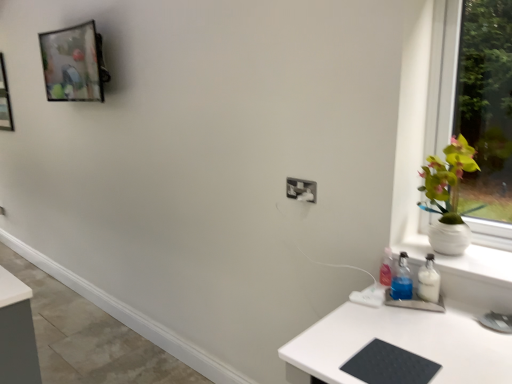
Where is `free area below metallic glass picture frame at upper left (from a real-world perspective)`? The image size is (512, 384). free area below metallic glass picture frame at upper left (from a real-world perspective) is located at coordinates (100, 321).